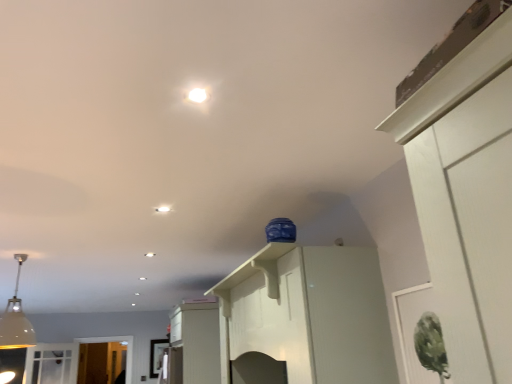
Question: Can you confirm if white glossy cabinet at center, the 1th cabinetry ordered from the bottom, is positioned to the right of white glossy light fixture at center?

Choices:
 (A) no
 (B) yes

Answer: (A)

Question: Is white glossy cabinet at center, which is counted as the first cabinetry, starting from the left, oriented towards white glossy light fixture at center?

Choices:
 (A) yes
 (B) no

Answer: (B)

Question: Considering the relative sizes of white glossy cabinet at center, which is counted as the first cabinetry, starting from the left, and white glossy light fixture at center in the image provided, is white glossy cabinet at center, which is counted as the first cabinetry, starting from the left, bigger than white glossy light fixture at center?

Choices:
 (A) yes
 (B) no

Answer: (A)

Question: Is white glossy cabinet at center, which is the 1th cabinetry in back-to-front order, next to white glossy light fixture at center?

Choices:
 (A) no
 (B) yes

Answer: (A)

Question: Does white glossy cabinet at center, the 2th cabinetry in the top-to-bottom sequence, have a smaller size compared to white glossy light fixture at center?

Choices:
 (A) yes
 (B) no

Answer: (B)

Question: Is white glossy cabinet at center, which is counted as the first cabinetry, starting from the left, in front of or behind white matte pendant light at left in the image?

Choices:
 (A) front
 (B) behind

Answer: (B)

Question: Choose the correct answer: Is white glossy cabinet at center, the 1th cabinetry ordered from the bottom, inside white matte pendant light at left or outside it?

Choices:
 (A) outside
 (B) inside

Answer: (A)

Question: Visually, is white glossy cabinet at center, the 2th cabinetry in the top-to-bottom sequence, positioned to the left or to the right of white matte pendant light at left?

Choices:
 (A) right
 (B) left

Answer: (A)

Question: Considering the positions of point (197, 377) and point (12, 297), is point (197, 377) closer or farther from the camera than point (12, 297)?

Choices:
 (A) closer
 (B) farther

Answer: (A)

Question: Which is correct: white glossy light fixture at center is inside white glossy light fixture at upper center, or outside of it?

Choices:
 (A) inside
 (B) outside

Answer: (B)

Question: From their relative heights in the image, would you say white glossy light fixture at center is taller or shorter than white glossy light fixture at upper center?

Choices:
 (A) short
 (B) tall

Answer: (A)

Question: Based on their sizes in the image, would you say white glossy light fixture at center is bigger or smaller than white glossy light fixture at upper center?

Choices:
 (A) small
 (B) big

Answer: (B)

Question: Is point (160, 211) closer or farther from the camera than point (198, 89)?

Choices:
 (A) closer
 (B) farther

Answer: (B)

Question: Based on their sizes in the image, would you say white matte pendant light at left is bigger or smaller than white glossy cabinet at center, the 1th cabinetry ordered from the bottom?

Choices:
 (A) small
 (B) big

Answer: (A)

Question: Is white matte pendant light at left inside the boundaries of white glossy cabinet at center, which is the 2th cabinetry in front-to-back order, or outside?

Choices:
 (A) inside
 (B) outside

Answer: (B)